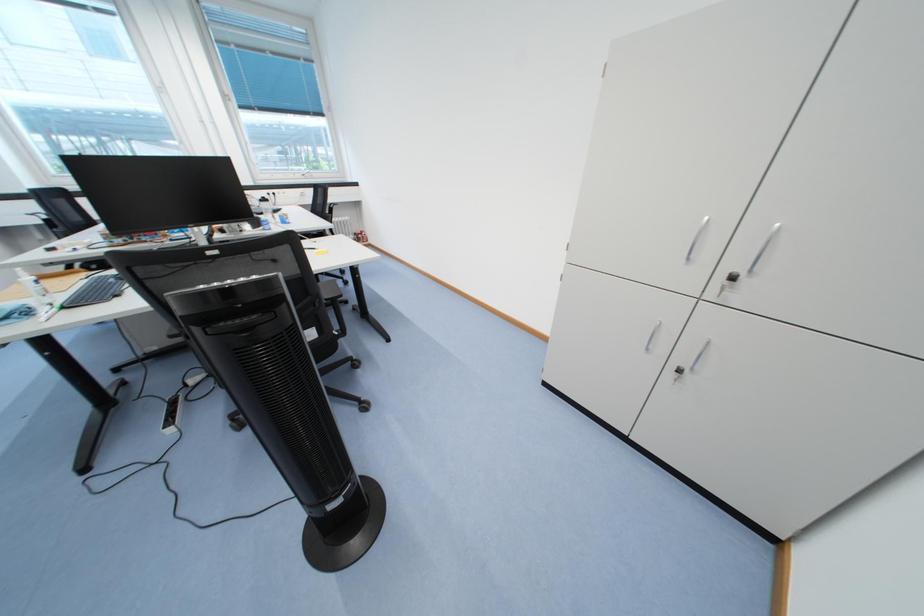
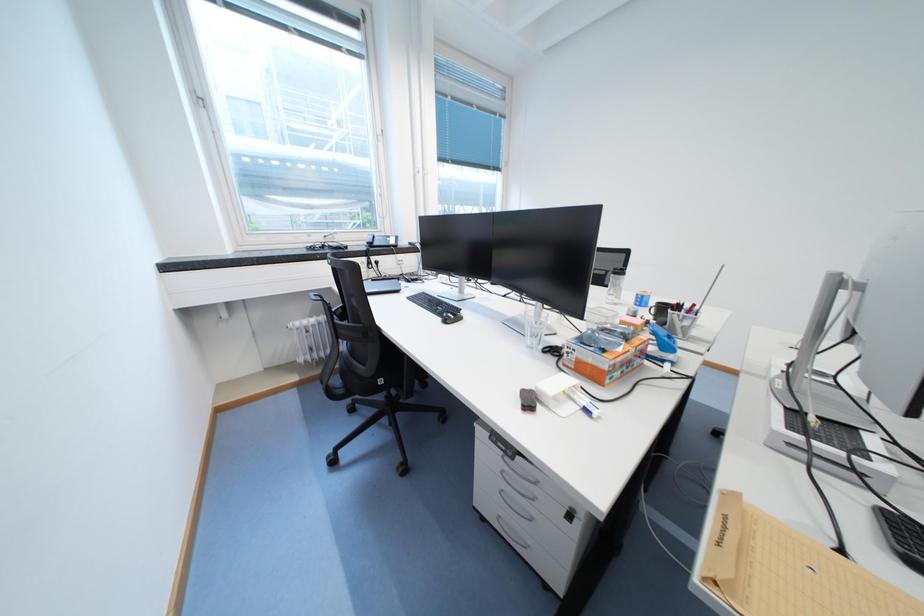
Question: Which direction would the cameraman need to move to produce the second image? Reply with the corresponding letter.

Choices:
 (A) Left
 (B) Right
 (C) Forward
 (D) Backward

Answer: (A)